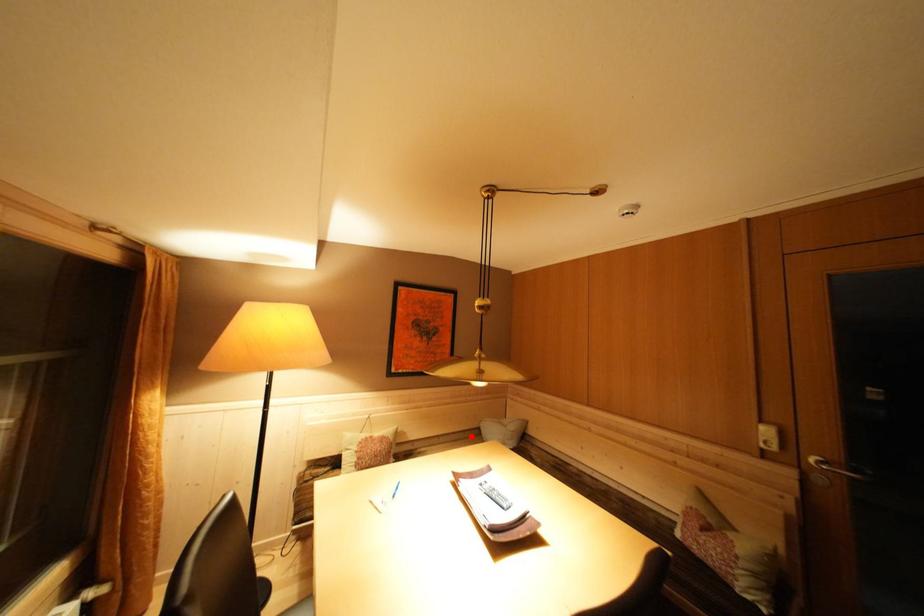
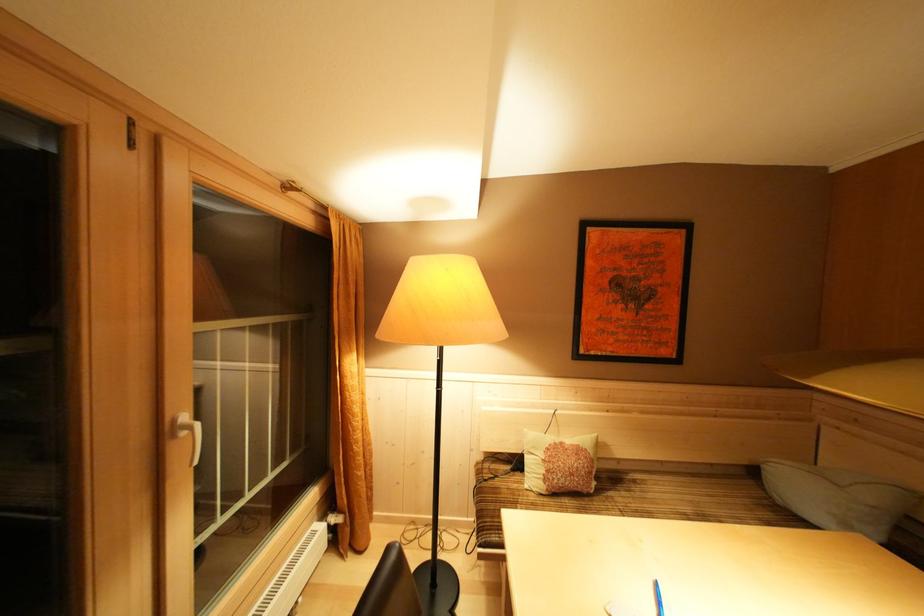
In the second image, find the point that corresponds to the highlighted location in the first image.

(718, 468)